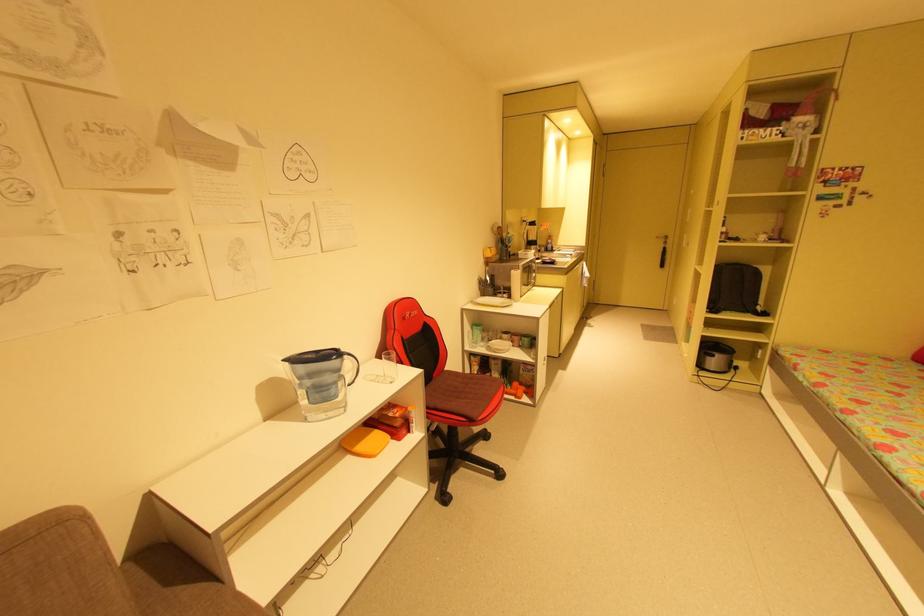
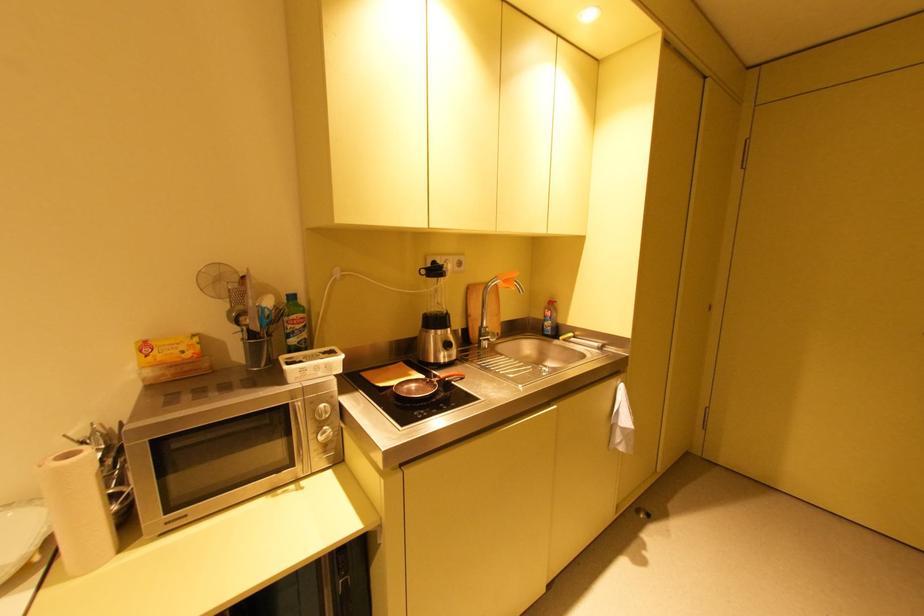
Where in the second image is the point corresponding to (x=540, y=222) from the first image?

(444, 267)